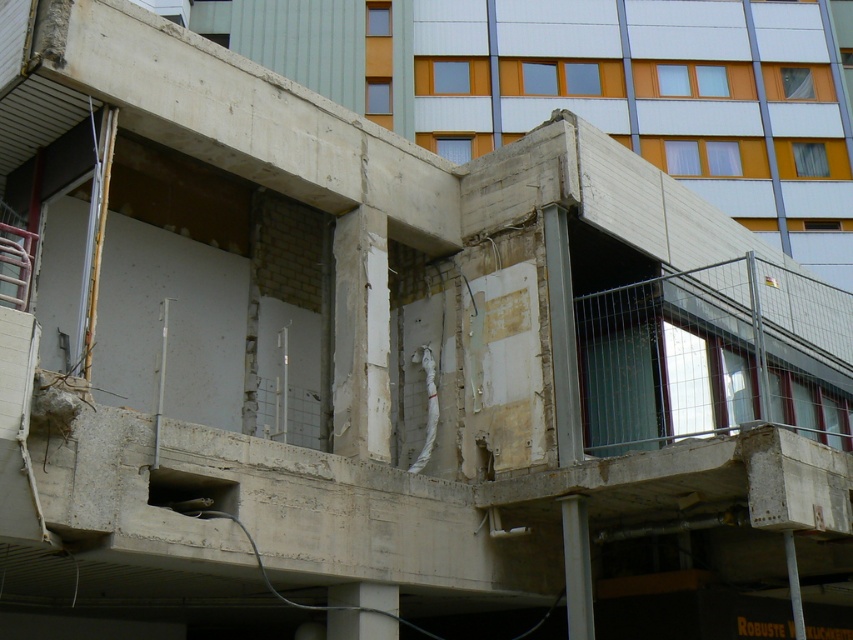
Who is positioned more to the left, concrete at lower center or concrete pillar at lower right?

From the viewer's perspective, concrete at lower center appears more on the left side.

This screenshot has width=853, height=640. Identify the location of concrete at lower center. (358, 625).

This screenshot has width=853, height=640. What do you see at coordinates (576, 566) in the screenshot?
I see `white concrete pillar at lower right` at bounding box center [576, 566].

Who is positioned more to the left, white concrete pillar at lower right or concrete at lower center?

Positioned to the left is concrete at lower center.

Is point (589, 547) positioned in front of point (358, 600)?

No, (589, 547) is behind (358, 600).

In order to click on white concrete pillar at lower right in this screenshot , I will do `click(576, 566)`.

Between white concrete pillar at lower right and concrete pillar at lower right, which one is positioned higher?

concrete pillar at lower right is above.

Does white concrete pillar at lower right come behind concrete pillar at lower right?

Yes, it is.

The image size is (853, 640). Identify the location of white concrete pillar at lower right. (576, 566).